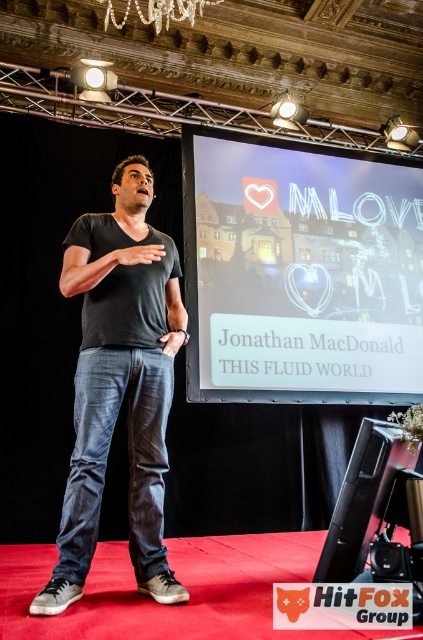
Question: Is matte black screen at center to the right of pearl-like crystal chandelier at upper center from the viewer's perspective?

Choices:
 (A) no
 (B) yes

Answer: (B)

Question: Observing the image, what is the correct spatial positioning of black matte t-shirt at center in reference to pearl-like crystal chandelier at upper center?

Choices:
 (A) below
 (B) above

Answer: (A)

Question: Which object is farther from the camera taking this photo?

Choices:
 (A) black matte t-shirt at center
 (B) matte black screen at center
 (C) pearl-like crystal chandelier at upper center

Answer: (B)

Question: Where is matte black screen at center located in relation to black matte t-shirt at center in the image?

Choices:
 (A) right
 (B) left

Answer: (A)

Question: Which point is closer to the camera taking this photo?

Choices:
 (A) (85, 541)
 (B) (186, 12)
 (C) (354, 195)

Answer: (A)

Question: Which point is closer to the camera?

Choices:
 (A) (93, 534)
 (B) (118, 22)

Answer: (A)